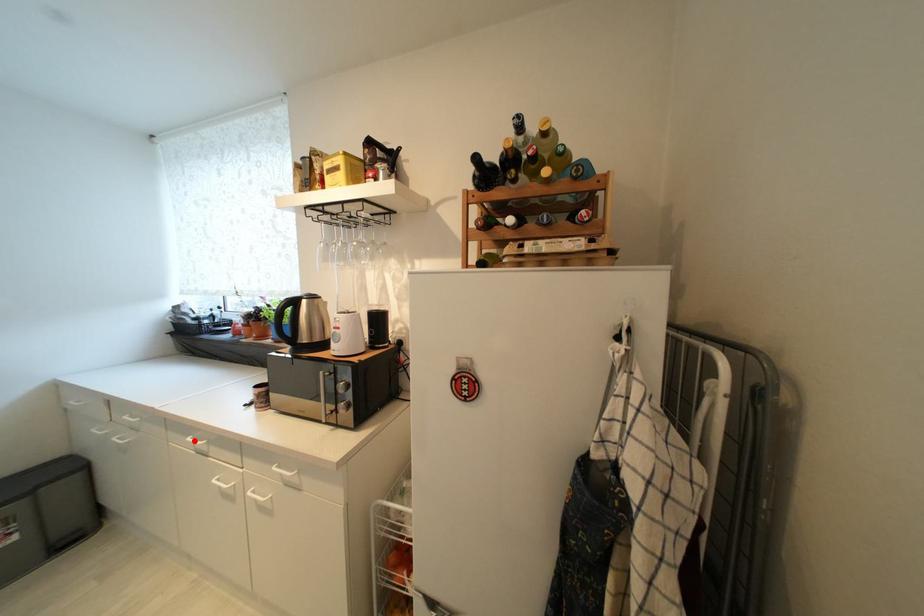
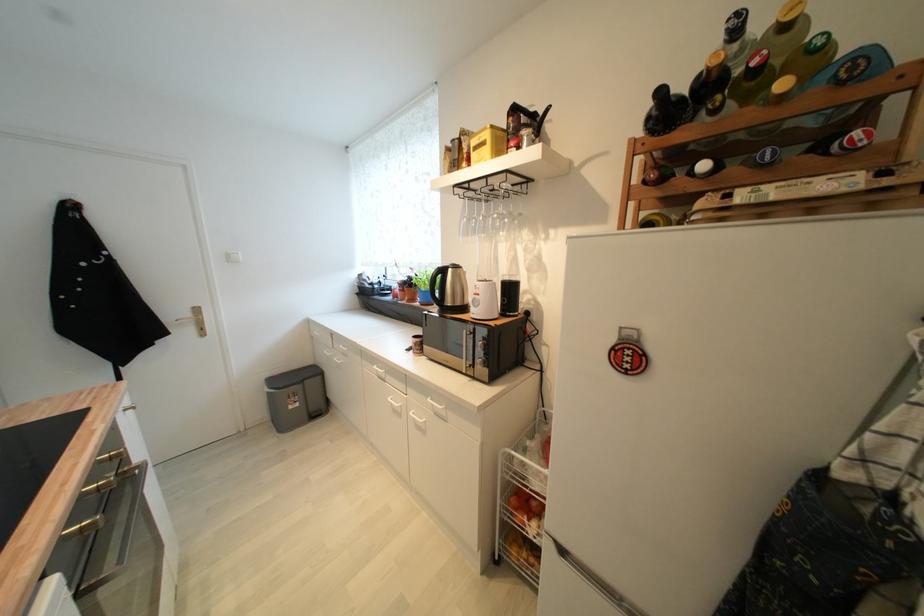
In the second image, find the point that corresponds to the highlighted location in the first image.

(380, 369)